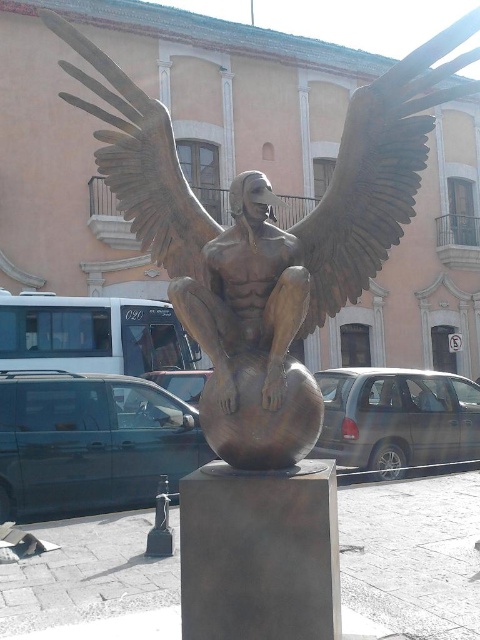
Question: Estimate the real-world distances between objects in this image. Which object is farther from the bronze wing at upper center?

Choices:
 (A) bronze wings at upper left
 (B) bronze statue at center

Answer: (A)

Question: Does bronze statue at center appear under bronze wing at upper center?

Choices:
 (A) no
 (B) yes

Answer: (B)

Question: Estimate the real-world distances between objects in this image. Which object is closer to the bronze statue at center?

Choices:
 (A) bronze wings at upper left
 (B) bronze wing at upper center

Answer: (A)

Question: Is bronze statue at center further to the viewer compared to bronze wing at upper center?

Choices:
 (A) yes
 (B) no

Answer: (B)

Question: Is bronze statue at center further to the viewer compared to bronze wing at upper center?

Choices:
 (A) yes
 (B) no

Answer: (B)

Question: Among these points, which one is nearest to the camera?

Choices:
 (A) (384, 116)
 (B) (143, 179)
 (C) (471, 60)

Answer: (C)